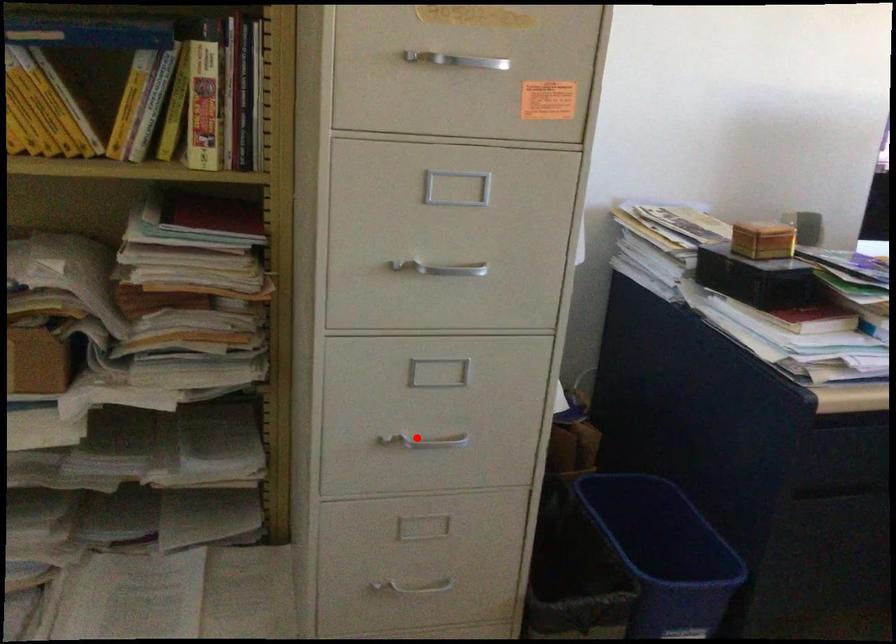
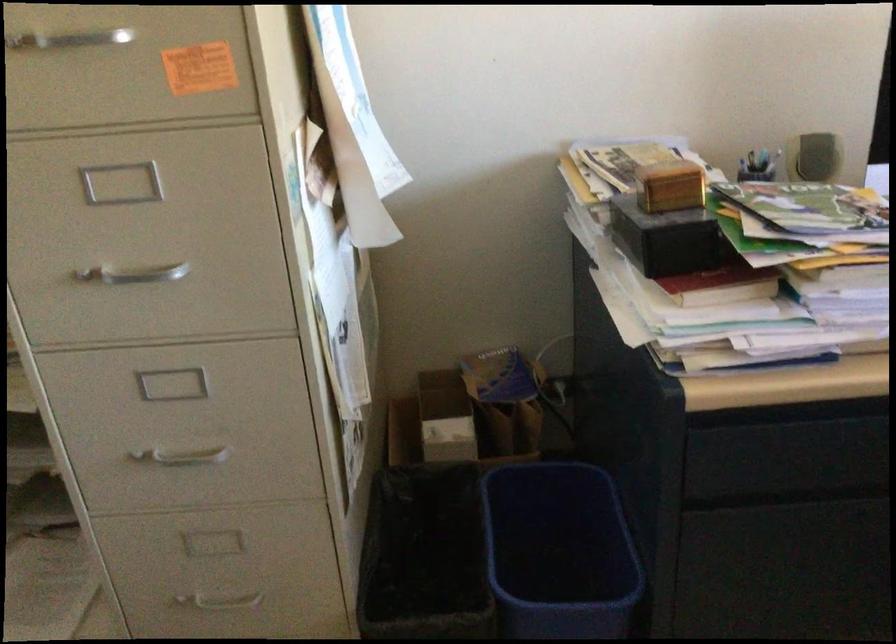
Question: I am providing you with two images of the same scene from different viewpoints. A red point is shown in image1. For the corresponding object point in image2, is it positioned nearer or farther from the camera?

Choices:
 (A) Nearer
 (B) Farther

Answer: (A)